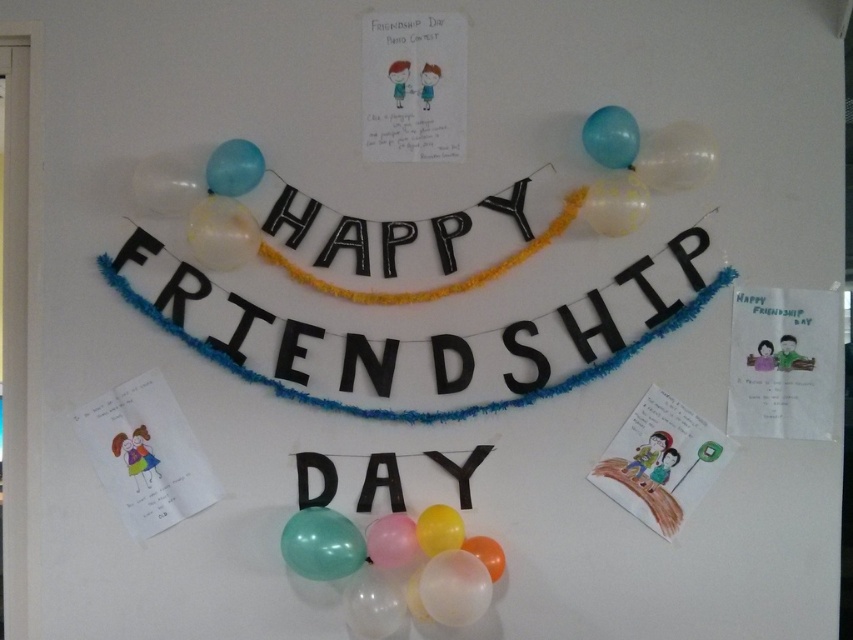
Is translucent glossy balloon at lower center below blue rubber balloon at upper right?

Correct, translucent glossy balloon at lower center is located below blue rubber balloon at upper right.

Does translucent glossy balloon at lower center have a smaller size compared to blue rubber balloon at upper right?

Actually, translucent glossy balloon at lower center might be larger than blue rubber balloon at upper right.

Who is more forward, [357,545] or [619,161]?

Positioned in front is point [357,545].

Locate an element on the screen. The height and width of the screenshot is (640, 853). translucent glossy balloon at lower center is located at coordinates (321, 545).

Does transparent plastic balloon at upper center have a lesser height compared to translucent blue balloon at upper center?

No.

Which is more to the left, transparent plastic balloon at upper center or translucent blue balloon at upper center?

translucent blue balloon at upper center

Who is more distant from viewer, [695,177] or [238,160]?

The point [238,160] is more distant.

This screenshot has width=853, height=640. In order to click on transparent plastic balloon at upper center in this screenshot , I will do `click(674, 156)`.

Does point (305, 481) come farther from viewer compared to point (582, 128)?

Yes, point (305, 481) is farther from viewer.

The image size is (853, 640). I want to click on black matte/day at center, so click(381, 483).

Describe the element at coordinates (381, 483) in the screenshot. The width and height of the screenshot is (853, 640). I see `black matte/day at center` at that location.

Where is `black matte/day at center`? The image size is (853, 640). black matte/day at center is located at coordinates (381, 483).